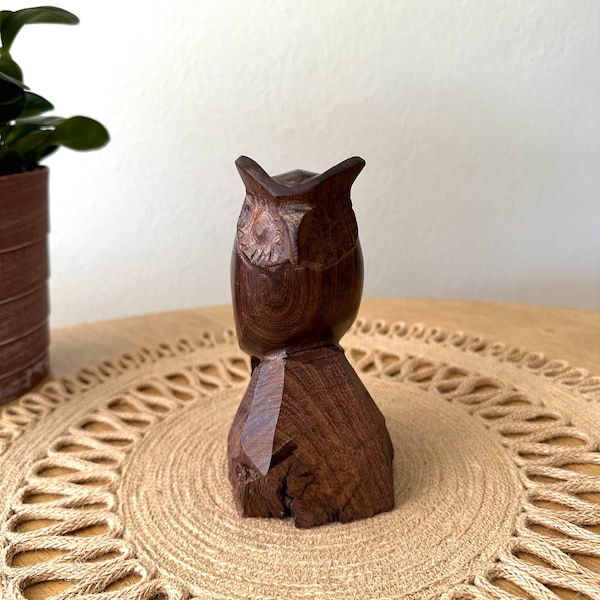
Where is `wall`? The height and width of the screenshot is (600, 600). wall is located at coordinates (487, 161).